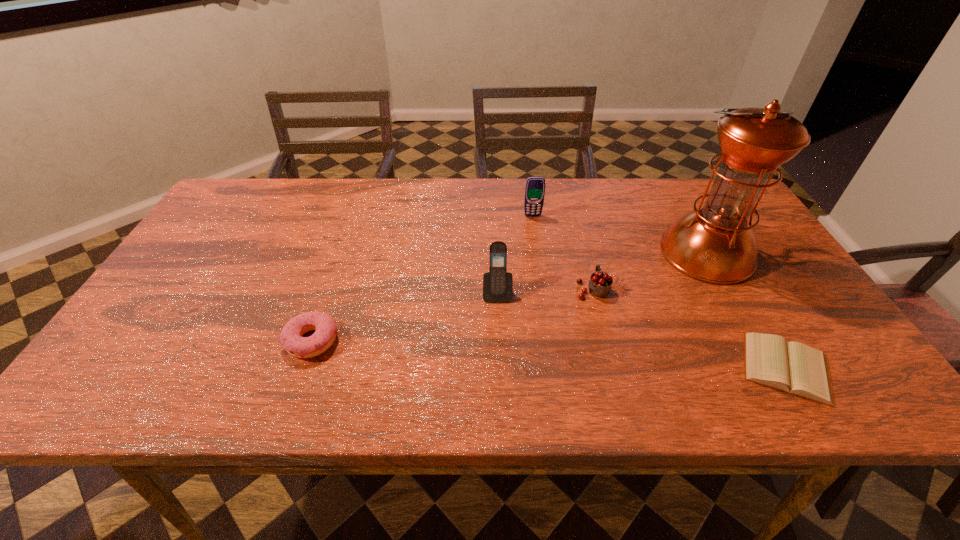
The image size is (960, 540). What are the coordinates of `free space between the tallest object and the right cellular telephone` in the screenshot? It's located at (619, 234).

Where is `free space between the leftmost object and the fifth object from right to left`? free space between the leftmost object and the fifth object from right to left is located at coordinates (404, 316).

I want to click on free spot between the leftmost object and the third object from left to right, so click(422, 278).

You are a GUI agent. You are given a task and a screenshot of the screen. Output one action in this format:
    pyautogui.click(x=<x>, y=<y>)
    Task: Click on the free space between the fifth object from right to left and the shortest object
    This screenshot has width=960, height=540.
    Given the screenshot: What is the action you would take?
    pyautogui.click(x=642, y=330)

This screenshot has height=540, width=960. I want to click on blank region between the right cellular telephone and the second object from left to right, so click(x=515, y=254).

Where is `object that is the fifth closest one to the oil lamp`? The width and height of the screenshot is (960, 540). object that is the fifth closest one to the oil lamp is located at coordinates (291, 339).

Image resolution: width=960 pixels, height=540 pixels. Find the location of `object that stands as the third closest to the shortest object`. object that stands as the third closest to the shortest object is located at coordinates tap(497, 283).

At what (x,y) coordinates should I click in order to perform the action: click on vacant space that satisfies the following two spatial constraints: 1. on the front-facing side of the right cellular telephone; 2. on the left side of the oil lamp. Please return your answer as a coordinate pair (x, y). This screenshot has width=960, height=540. Looking at the image, I should click on (538, 253).

Identify the location of vacant region that satisfies the following two spatial constraints: 1. on the handle side of the tallest object; 2. on the left side of the third object from right to left. The height and width of the screenshot is (540, 960). (583, 253).

Locate an element on the screen. vacant region that satisfies the following two spatial constraints: 1. on the front-facing side of the tallest object; 2. on the left side of the right cellular telephone is located at coordinates (538, 253).